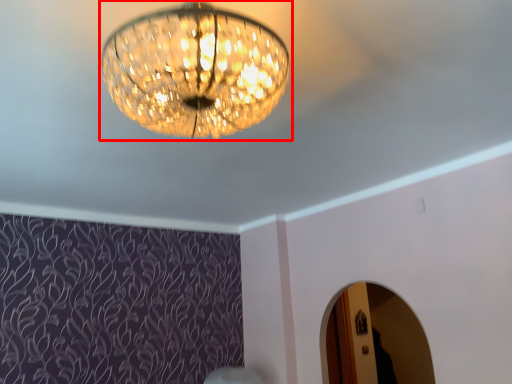
Question: From the image, what is the correct spatial relationship of lamp (annotated by the red box) in relation to mirror?

Choices:
 (A) left
 (B) right

Answer: (A)